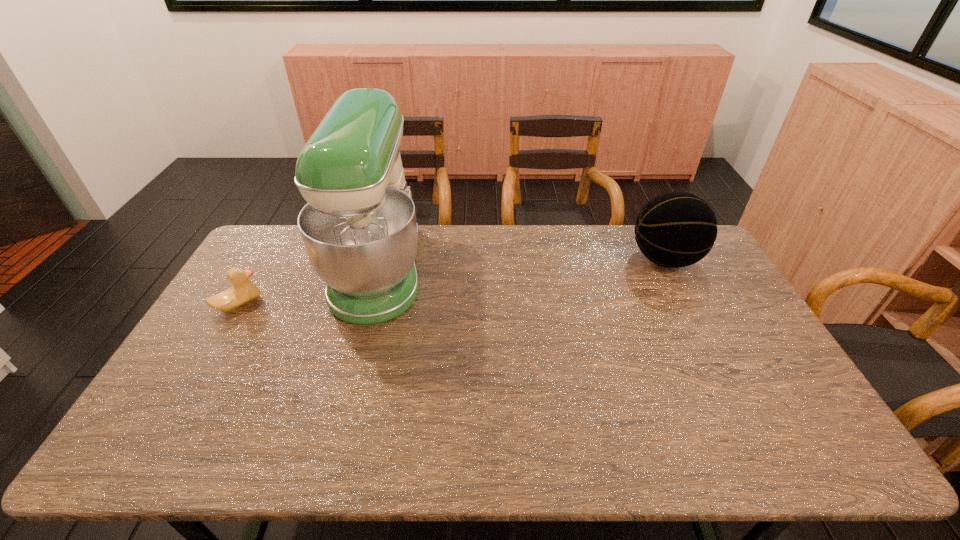
The image size is (960, 540). I want to click on basketball located in the far edge section of the desktop, so click(676, 229).

Find the location of a particular element. This screenshot has width=960, height=540. object present at the left edge is located at coordinates (243, 291).

This screenshot has height=540, width=960. In order to click on object located at the right edge in this screenshot , I will do [x=676, y=229].

Find the location of a particular element. The image size is (960, 540). object at the far right corner is located at coordinates (676, 229).

The width and height of the screenshot is (960, 540). In the image, there is a desktop. What are the coordinates of `vacant area at the far edge` in the screenshot? It's located at (595, 237).

This screenshot has height=540, width=960. I want to click on blank space at the near edge, so click(x=564, y=458).

Identify the location of vacant space at the left edge of the desktop. (198, 334).

The width and height of the screenshot is (960, 540). I want to click on vacant space at the near right corner, so click(x=790, y=452).

The image size is (960, 540). I want to click on free space between the rightmost object and the duck, so click(x=452, y=282).

At what (x,y) coordinates should I click in order to perform the action: click on free space between the shortest object and the second shortest object. Please return your answer as a coordinate pair (x, y). Looking at the image, I should click on pos(452,282).